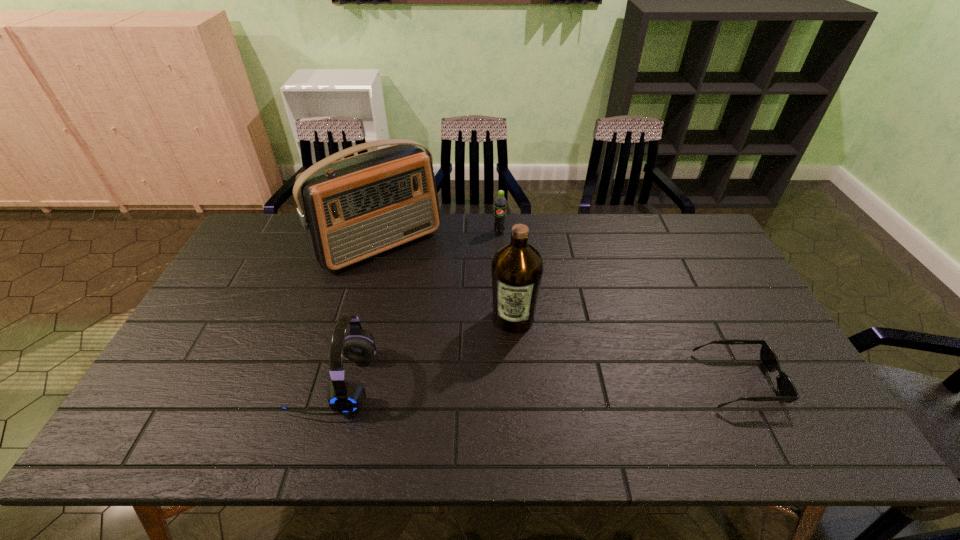
At what (x,y) coordinates should I click in order to perform the action: click on vacant space located on the front label of the soda. Please return your answer as a coordinate pair (x, y). This screenshot has width=960, height=540. Looking at the image, I should click on (493, 306).

At what (x,y) coordinates should I click in order to perform the action: click on vacant space located 0.290m on the front label of the soda. Please return your answer as a coordinate pair (x, y). This screenshot has width=960, height=540. Looking at the image, I should click on (494, 294).

Where is `free space located on the label of the third nearest object`? free space located on the label of the third nearest object is located at coordinates (500, 410).

The width and height of the screenshot is (960, 540). I want to click on free location located on the label of the third nearest object, so click(505, 379).

Identify the location of vacant space located 0.080m on the label of the third nearest object. The height and width of the screenshot is (540, 960). (508, 359).

This screenshot has height=540, width=960. I want to click on free spot located 0.130m on the front-facing side of the radio receiver, so click(x=430, y=295).

Where is `free spot located 0.190m on the front-facing side of the radio receiver`? free spot located 0.190m on the front-facing side of the radio receiver is located at coordinates (440, 307).

The image size is (960, 540). Identify the location of vacant space located 0.110m on the front-facing side of the radio receiver. (426, 291).

The height and width of the screenshot is (540, 960). What are the coordinates of `soda situated at the far edge` in the screenshot? It's located at (500, 204).

Where is `radio receiver located in the far edge section of the desktop`? radio receiver located in the far edge section of the desktop is located at coordinates (352, 209).